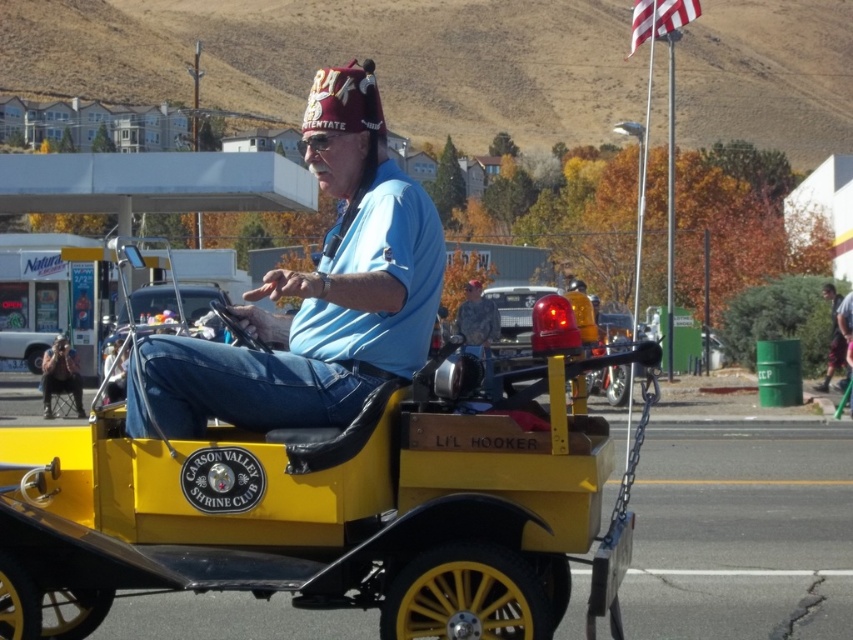
You are a photographer standing in front of the yellow matte wagon at center and the dark blue jeans at lower left. Which object is nearer to you?

The yellow matte wagon at center is closer to the viewer than the dark blue jeans at lower left.

You are standing in front of the vintage yellow car at the parade. There are two points marked on the car, one at coordinate point (x=461, y=444) and the other at point (x=834, y=291). Which point is closer to you?

Point (x=461, y=444) is closer to the camera than point (x=834, y=291).